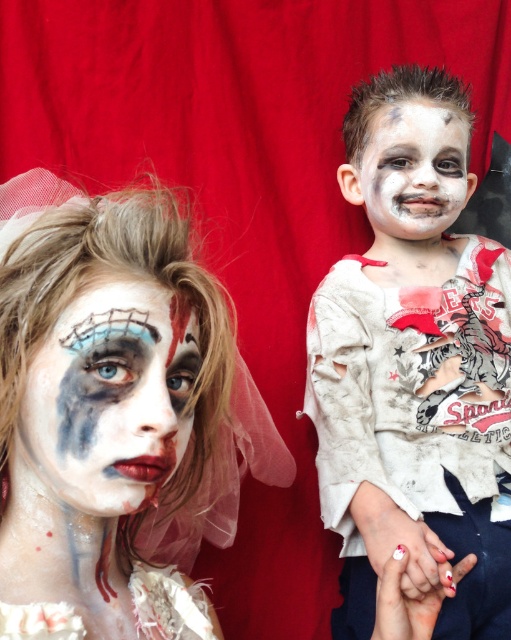
Question: Which of these objects is positioned farthest from the white matte shirt at right?

Choices:
 (A) matte painted face at center
 (B) matte white face paint at center
 (C) white matte face paint at upper right

Answer: (A)

Question: Is matte white face paint at center positioned before white matte shirt at right?

Choices:
 (A) yes
 (B) no

Answer: (A)

Question: From the image, what is the correct spatial relationship of matte white face paint at center in relation to white matte shirt at right?

Choices:
 (A) left
 (B) right

Answer: (A)

Question: Which point appears farthest from the camera in this image?

Choices:
 (A) (x=398, y=339)
 (B) (x=142, y=371)
 (C) (x=438, y=211)
 (D) (x=115, y=282)

Answer: (C)

Question: Which of the following is the farthest from the observer?

Choices:
 (A) white matte face paint at upper right
 (B) matte painted face at center
 (C) matte white face paint at center

Answer: (A)

Question: Does white matte shirt at right come in front of white matte face paint at upper right?

Choices:
 (A) no
 (B) yes

Answer: (B)